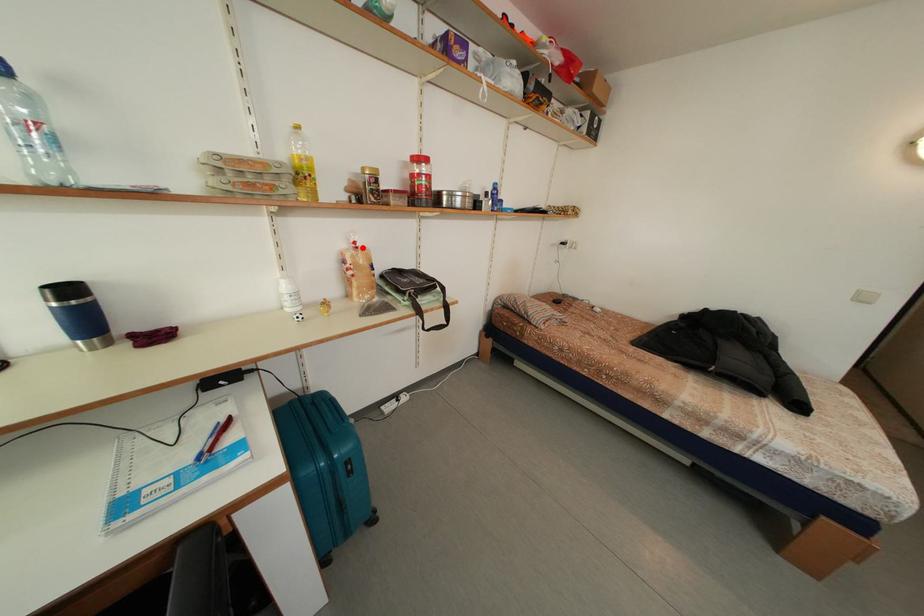
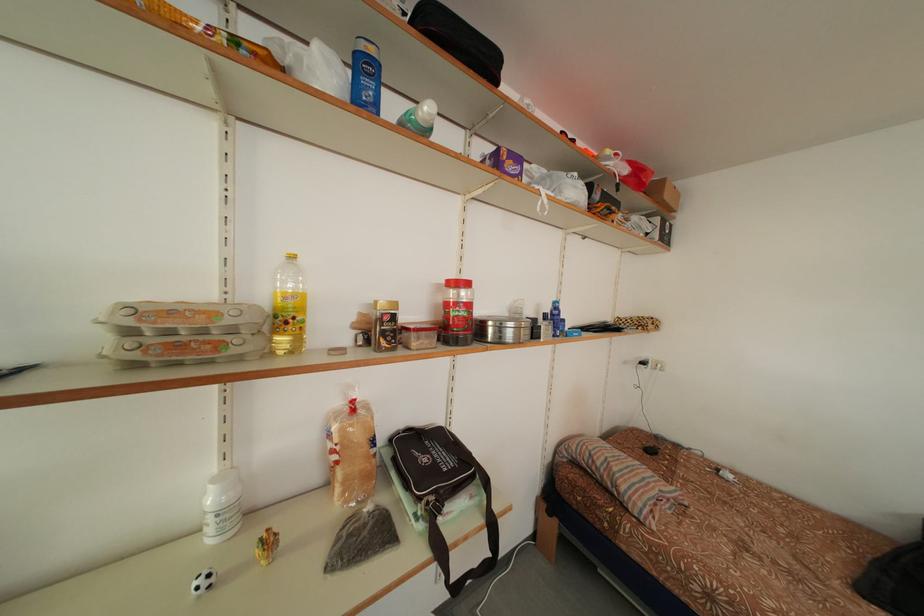
Locate, in the second image, the point that corresponds to the highlighted location in the first image.

(360, 407)